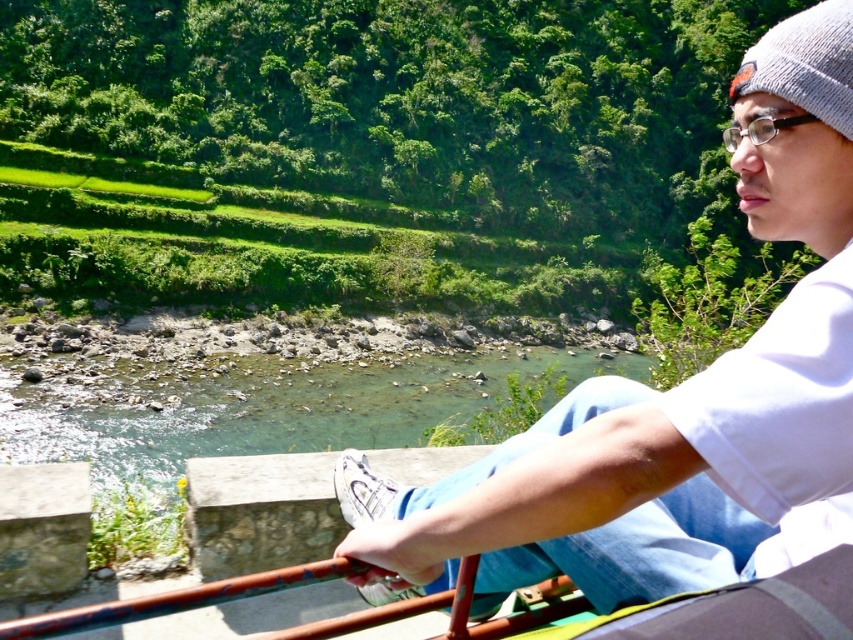
You are standing at the point marked by the coordinates point (659, 493) and want to walk towards the point marked by point (476, 564). Given the scene described, would you need to go uphill or downhill to reach your destination?

Since point (659, 493) is in front of point (476, 564), you would need to go downhill to reach point (476, 564) from point (659, 493).

You are a photographer standing on the concrete bench with a metal railing. You want to take a photo of the clear water at river center while also including the white cotton shirt at upper right in the frame. Can you position yourself so that both are visible in the same shot?

The white cotton shirt at upper right is 25.03 meters away from the clear water at river center. Since the photographer is on the concrete bench with a metal railing, they can position themselves centrally to include both objects within the camera frame.

You are a photographer planning to capture a landscape photo of the scene. You need to ensure that the white cotton shirt at upper right and the clear water at river center are both visible in the frame. Considering their sizes, which object should you prioritize framing closer to avoid it being too small in the photo?

The white cotton shirt at upper right is smaller in size compared to the clear water at river center. To ensure it is visible, you should prioritize framing the white cotton shirt at upper right closer to the camera.